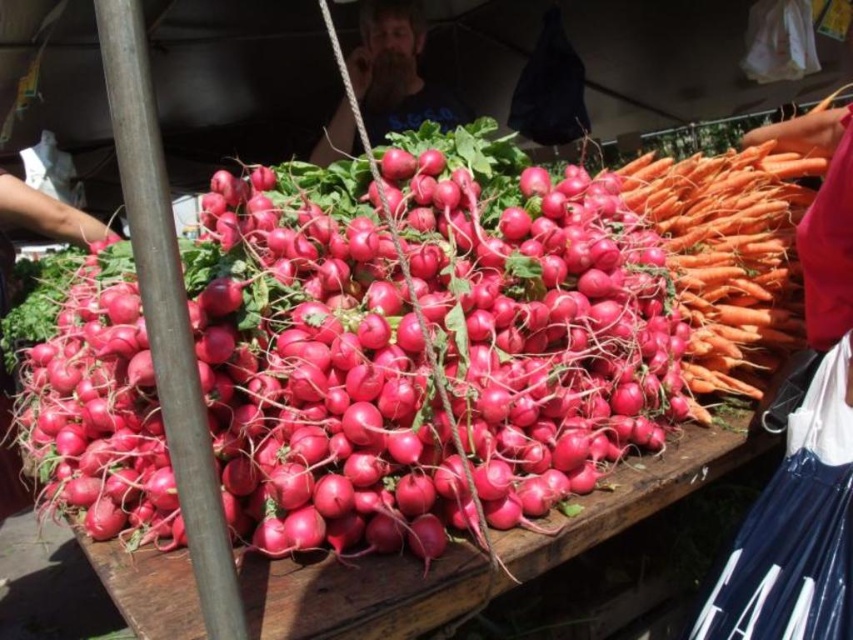
Does orange smooth carrot at right lie in front of bearded man at center?

Yes.

What do you see at coordinates (729, 257) in the screenshot? I see `orange smooth carrot at right` at bounding box center [729, 257].

The height and width of the screenshot is (640, 853). Find the location of `orange smooth carrot at right`. orange smooth carrot at right is located at coordinates (729, 257).